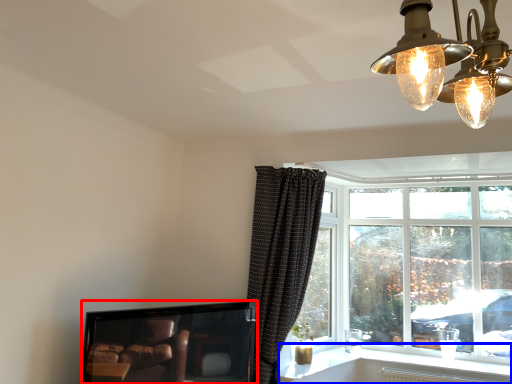
Question: Which of the following is the closest to the observer, television (highlighted by a red box) or window sill (highlighted by a blue box)?

Choices:
 (A) television
 (B) window sill

Answer: (A)